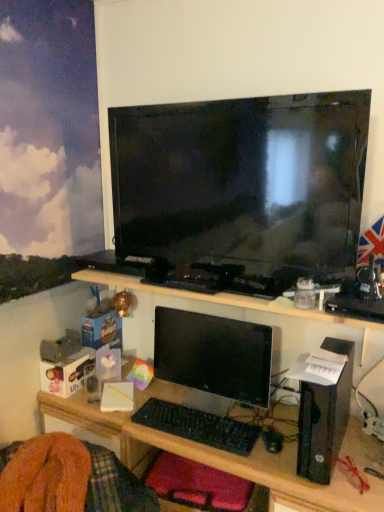
Identify the location of vacant area situated to the left side of black plastic mouse at lower center. (240, 443).